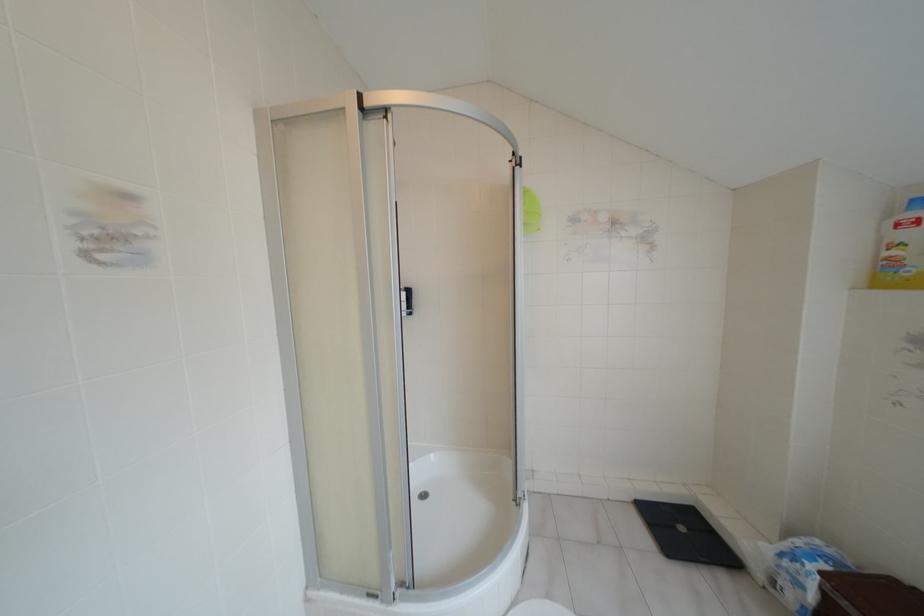
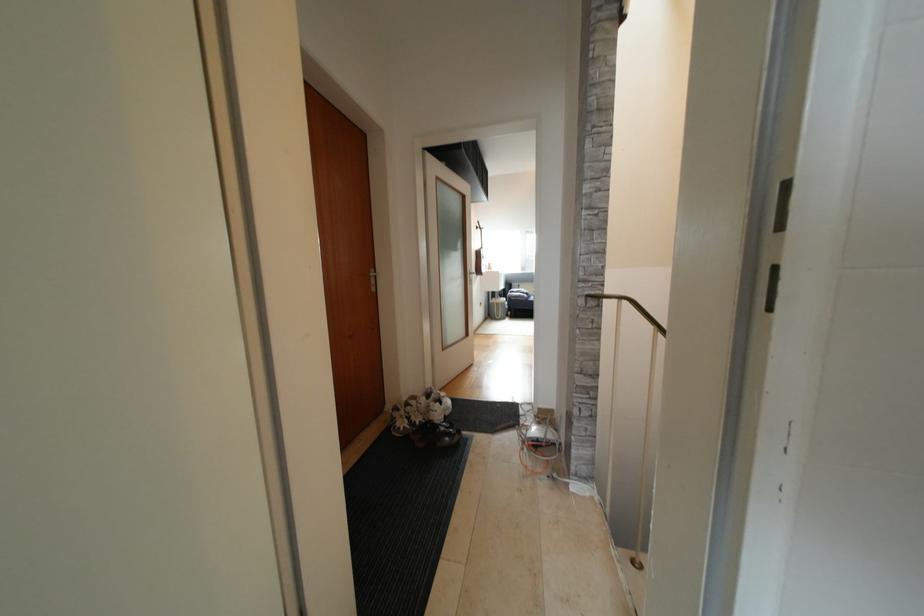
Question: Based on the continuous images, in which direction is the camera rotating? Reply with the corresponding letter.

Choices:
 (A) Left
 (B) Right
 (C) Up
 (D) Down

Answer: (A)